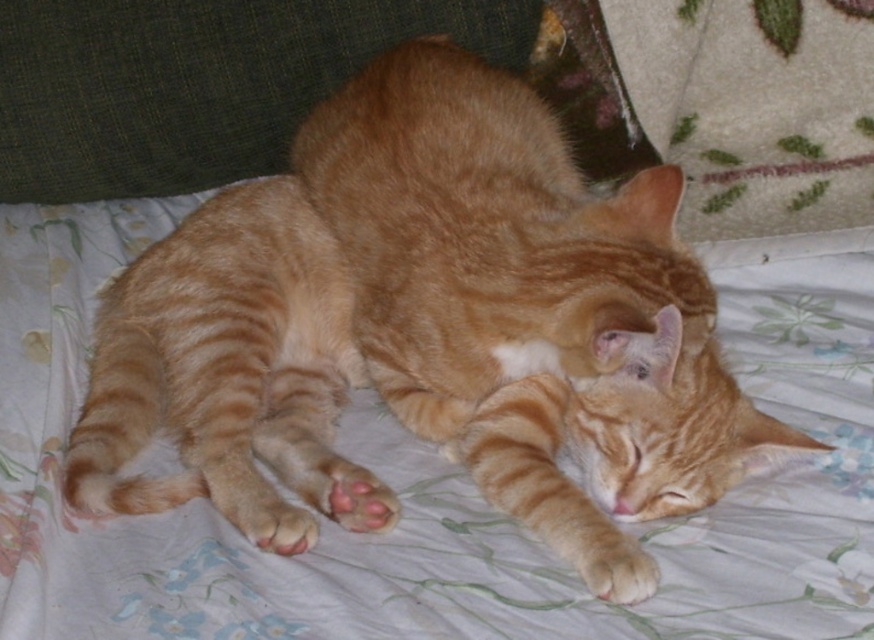
Question: Where is green fabric pillow at upper left located in relation to orange fur paw at lower center in the image?

Choices:
 (A) right
 (B) left

Answer: (B)

Question: Does green fabric pillow at upper left have a smaller size compared to orange fur paw at lower center?

Choices:
 (A) yes
 (B) no

Answer: (B)

Question: Does green fabric pillow at upper left appear under orange fur paw at lower center?

Choices:
 (A) no
 (B) yes

Answer: (A)

Question: Which point is closer to the camera?

Choices:
 (A) orange fur paw at lower center
 (B) green fabric pillow at upper left

Answer: (A)

Question: Which point is closer to the camera?

Choices:
 (A) orange fur paw at lower center
 (B) green fabric pillow at upper left

Answer: (A)